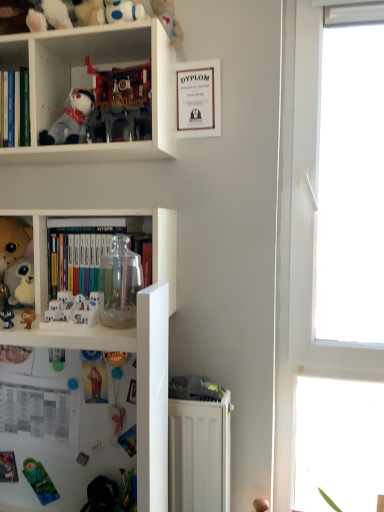
Question: Considering the relative sizes of translucent plastic toy at lower left, the 8th toy in the top-to-bottom sequence, and fluffy plush toy at left, which is the 3th toy from top to bottom, in the image provided, is translucent plastic toy at lower left, the 8th toy in the top-to-bottom sequence, thinner than fluffy plush toy at left, which is the 3th toy from top to bottom,?

Choices:
 (A) yes
 (B) no

Answer: (A)

Question: Can you confirm if translucent plastic toy at lower left, marked as the first toy in a bottom-to-top arrangement, is smaller than fluffy plush toy at left, which appears as the 6th toy when ordered from the bottom?

Choices:
 (A) yes
 (B) no

Answer: (A)

Question: Is translucent plastic toy at lower left, the 8th toy in the top-to-bottom sequence, behind fluffy plush toy at left, which is the 3th toy from top to bottom?

Choices:
 (A) yes
 (B) no

Answer: (B)

Question: From the image's perspective, is translucent plastic toy at lower left, marked as the first toy in a bottom-to-top arrangement, on fluffy plush toy at left, which appears as the 6th toy when ordered from the bottom?

Choices:
 (A) yes
 (B) no

Answer: (B)

Question: From a real-world perspective, is translucent plastic toy at lower left, the 8th toy in the top-to-bottom sequence, physically below fluffy plush toy at left, which appears as the 6th toy when ordered from the bottom?

Choices:
 (A) yes
 (B) no

Answer: (A)

Question: Considering the relative sizes of translucent plastic toy at lower left, marked as the first toy in a bottom-to-top arrangement, and fluffy plush toy at left, which appears as the 6th toy when ordered from the bottom, in the image provided, is translucent plastic toy at lower left, marked as the first toy in a bottom-to-top arrangement, wider than fluffy plush toy at left, which appears as the 6th toy when ordered from the bottom,?

Choices:
 (A) yes
 (B) no

Answer: (B)

Question: Is pink fabric toy at lower center, positioned as the 7th toy in top-to-bottom order, at the right side of white plastic dice at lower left, the fifth toy viewed from the top?

Choices:
 (A) no
 (B) yes

Answer: (B)

Question: Does pink fabric toy at lower center, arranged as the second toy when ordered from the bottom, touch white plastic dice at lower left, the fifth toy viewed from the top?

Choices:
 (A) yes
 (B) no

Answer: (B)

Question: Is pink fabric toy at lower center, positioned as the 7th toy in top-to-bottom order, thinner than white plastic dice at lower left, the fifth toy viewed from the top?

Choices:
 (A) yes
 (B) no

Answer: (B)

Question: Considering the relative sizes of pink fabric toy at lower center, arranged as the second toy when ordered from the bottom, and white plastic dice at lower left, the fifth toy viewed from the top, in the image provided, is pink fabric toy at lower center, arranged as the second toy when ordered from the bottom, wider than white plastic dice at lower left, the fifth toy viewed from the top,?

Choices:
 (A) yes
 (B) no

Answer: (A)

Question: Does pink fabric toy at lower center, arranged as the second toy when ordered from the bottom, come in front of white plastic dice at lower left, arranged as the fourth toy when ordered from the bottom?

Choices:
 (A) yes
 (B) no

Answer: (B)

Question: From a real-world perspective, is pink fabric toy at lower center, arranged as the second toy when ordered from the bottom, over white plastic dice at lower left, the fifth toy viewed from the top?

Choices:
 (A) no
 (B) yes

Answer: (A)

Question: Does translucent plastic toy at lower left, the 8th toy in the top-to-bottom sequence, have a larger size compared to white plastic bookcase at center, marked as the second bookcase in a top-to-bottom arrangement?

Choices:
 (A) yes
 (B) no

Answer: (B)